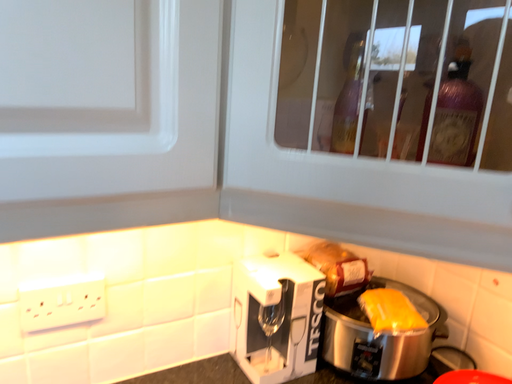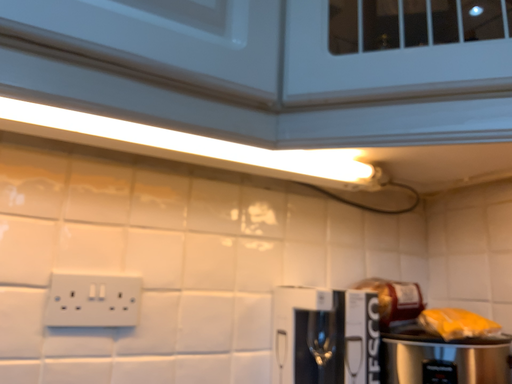
Question: How did the camera likely rotate when shooting the video?

Choices:
 (A) rotated upward
 (B) rotated downward

Answer: (A)